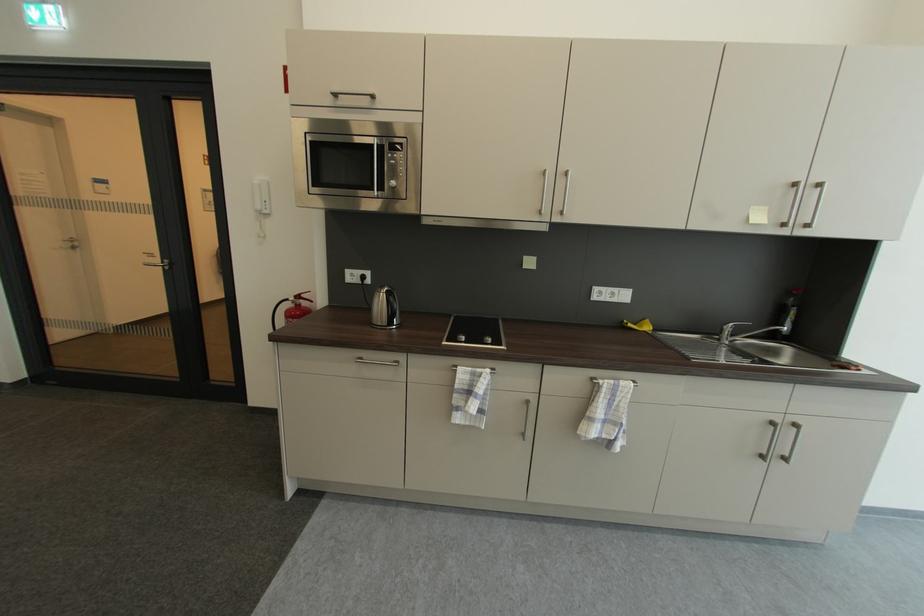
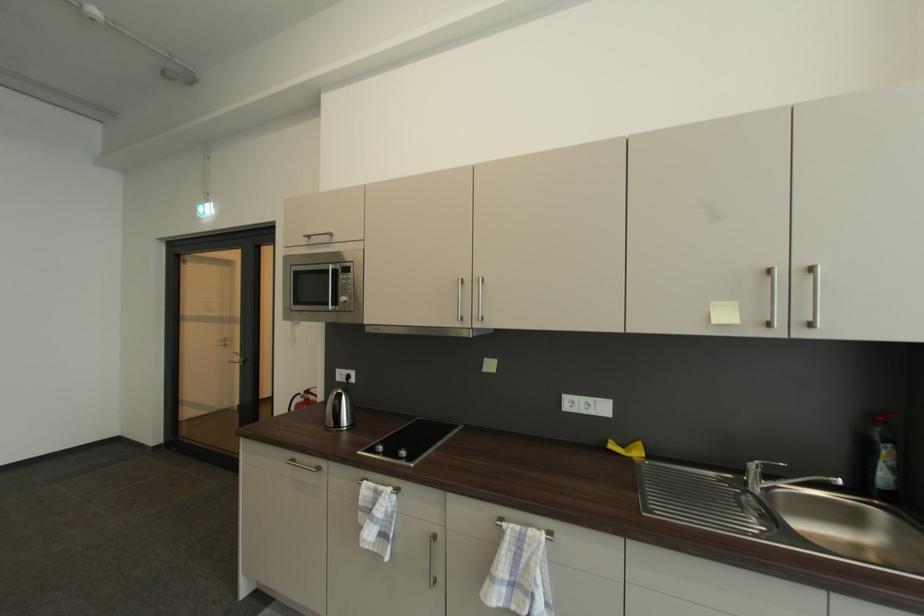
In the second image, find the point that corresponds to [633,382] in the first image.

(545, 531)